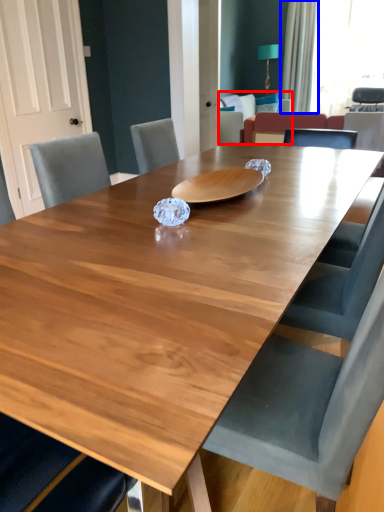
Question: Which object appears farthest to the camera in this image, armchair (highlighted by a red box) or curtain (highlighted by a blue box)?

Choices:
 (A) armchair
 (B) curtain

Answer: (B)